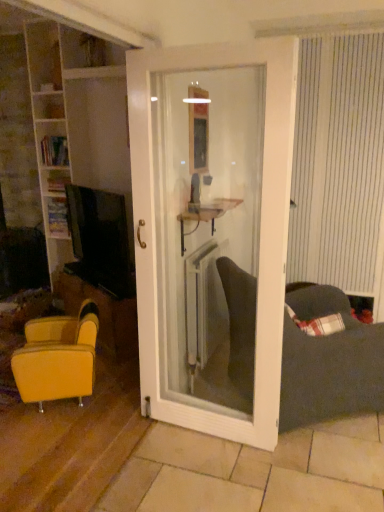
Identify the location of vacant space in front of white wooden door at center. (209, 473).